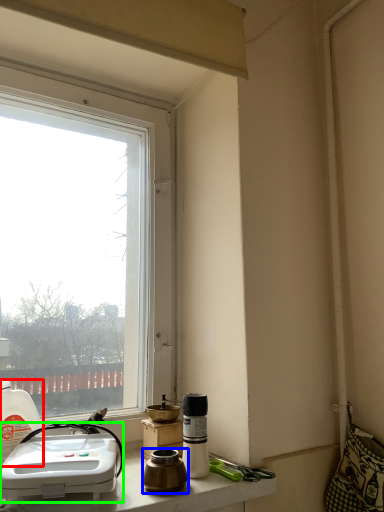
Question: Which object is the closest to the bottle (highlighted by a red box)? Choose among these: coffee cup (highlighted by a blue box) or sink (highlighted by a green box).

Choices:
 (A) coffee cup
 (B) sink

Answer: (B)